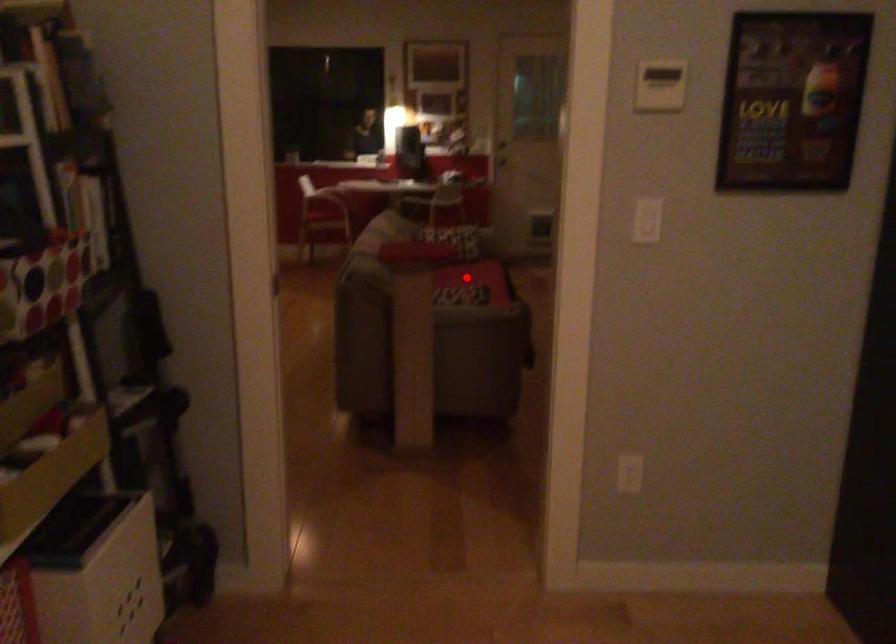
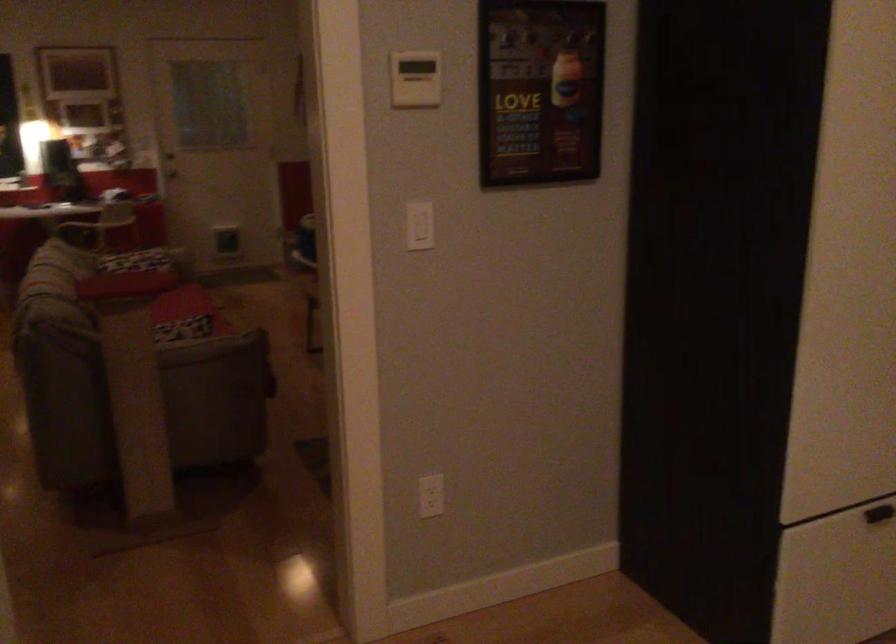
Question: I am providing you with two images of the same scene from different viewpoints. Image1 has a red point marked. In image2, the corresponding 3D location appears at what relative position? Reply with the corresponding letter.

Choices:
 (A) Closer
 (B) Farther

Answer: (A)